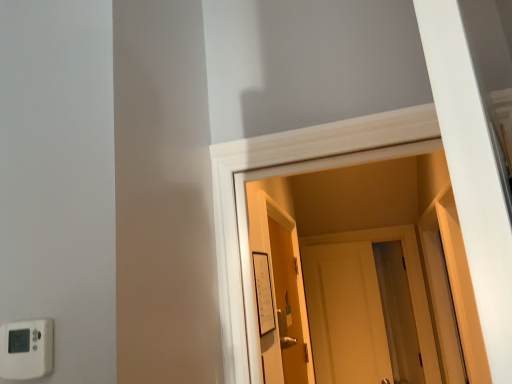
Locate an element on the screen. white paper at center, the 2th light switch in the left-to-right sequence is located at coordinates (263, 293).

Describe the element at coordinates (26, 349) in the screenshot. The image size is (512, 384). I see `white plastic thermostat at lower left, the first light switch when ordered from front to back` at that location.

How much space does white plastic thermostat at lower left, the second light switch positioned from the back, occupy vertically?

9.48 centimeters.

Find the location of `white matte door at center, acting as the 2th door starting from the left`. white matte door at center, acting as the 2th door starting from the left is located at coordinates (408, 281).

Which of these two, white matte door at center, which is the 1th door from back to front, or white plastic thermostat at lower left, the second light switch in the right-to-left sequence, stands taller?

With more height is white matte door at center, which is the 1th door from back to front.

Does point (402, 244) lie in front of point (24, 364)?

No.

Is white matte door at center, which is the 1th door from back to front, in front of or behind white plastic thermostat at lower left, the first light switch when ordered from front to back, in the image?

Visually, white matte door at center, which is the 1th door from back to front, is located behind white plastic thermostat at lower left, the first light switch when ordered from front to back.

In terms of size, does white matte door at center, which is the 1th door from back to front, appear bigger or smaller than white plastic thermostat at lower left, the first light switch when ordered from front to back?

In the image, white matte door at center, which is the 1th door from back to front, appears to be larger than white plastic thermostat at lower left, the first light switch when ordered from front to back.

This screenshot has width=512, height=384. There is a white plastic thermostat at lower left, the second light switch in the right-to-left sequence. Find the location of `the 2nd door below it (from a real-world perspective)`. the 2nd door below it (from a real-world perspective) is located at coordinates (408, 281).

From a real-world perspective, is white plastic thermostat at lower left, the first light switch when ordered from front to back, positioned under white matte door at center, acting as the 2th door starting from the left, based on gravity?

No, from a real-world perspective, white plastic thermostat at lower left, the first light switch when ordered from front to back, is not under white matte door at center, acting as the 2th door starting from the left.

Is white plastic thermostat at lower left, the second light switch in the right-to-left sequence, to the right of white matte door at center, which is the 1th door from back to front, from the viewer's perspective?

Incorrect, white plastic thermostat at lower left, the second light switch in the right-to-left sequence, is not on the right side of white matte door at center, which is the 1th door from back to front.

Is white plastic thermostat at lower left, the second light switch in the right-to-left sequence, next to white matte door at center, which is the second door in front-to-back order, and touching it?

white plastic thermostat at lower left, the second light switch in the right-to-left sequence, is not next to white matte door at center, which is the second door in front-to-back order, and they're not touching.

Is white paper at center, the 2th light switch in the left-to-right sequence, aimed at white plastic thermostat at lower left, positioned as the 1th light switch in left-to-right order?

No.

Does white paper at center, acting as the first light switch starting from the right, have a larger size compared to white plastic thermostat at lower left, positioned as the 1th light switch in left-to-right order?

Yes, white paper at center, acting as the first light switch starting from the right, is bigger than white plastic thermostat at lower left, positioned as the 1th light switch in left-to-right order.

Is white paper at center, acting as the first light switch starting from the right, positioned before white plastic thermostat at lower left, the second light switch positioned from the back?

No, it is behind white plastic thermostat at lower left, the second light switch positioned from the back.

From their relative heights in the image, would you say white paper at center, the 2th light switch in the left-to-right sequence, is taller or shorter than white plastic thermostat at lower left, the first light switch when ordered from front to back?

In the image, white paper at center, the 2th light switch in the left-to-right sequence, appears to be taller than white plastic thermostat at lower left, the first light switch when ordered from front to back.

Does white matte door at center, which is the 1th door from back to front, contain white paper at center, the 1th light switch viewed from the back?

That's incorrect, white paper at center, the 1th light switch viewed from the back, is not inside white matte door at center, which is the 1th door from back to front.

From the picture: Is there a large distance between white matte door at center, acting as the 2th door starting from the left, and white paper at center, which is counted as the 2th light switch, starting from the front?

Absolutely, white matte door at center, acting as the 2th door starting from the left, is distant from white paper at center, which is counted as the 2th light switch, starting from the front.

From a real-world perspective, count 2nd light switchs upward from the white matte door at center, which is the first door from right to left, and point to it. Please provide its 2D coordinates.

[(263, 293)]

Considering the positions of points (417, 252) and (255, 255), is point (417, 252) closer to camera compared to point (255, 255)?

No, (417, 252) is behind (255, 255).

From the picture: Which is more to the left, white matte door at center, which is the 1th door from back to front, or wooden door at center, positioned as the 1th door in front-to-back order?

wooden door at center, positioned as the 1th door in front-to-back order.

Is white matte door at center, which is the second door in front-to-back order, oriented towards wooden door at center, positioned as the 1th door in front-to-back order?

Yes, white matte door at center, which is the second door in front-to-back order, is turned towards wooden door at center, positioned as the 1th door in front-to-back order.

Which is closer, (436, 353) or (288, 348)?

Point (436, 353) is positioned farther from the camera compared to point (288, 348).

From a real-world perspective, is white matte door at center, acting as the 2th door starting from the left, physically above wooden door at center, marked as the 1th door in a left-to-right arrangement?

Actually, white matte door at center, acting as the 2th door starting from the left, is physically below wooden door at center, marked as the 1th door in a left-to-right arrangement, in the real world.

Is white paper at center, the 2th light switch in the left-to-right sequence, turned away from wooden door at center, the second door positioned from the right?

No, white paper at center, the 2th light switch in the left-to-right sequence, is not facing away from wooden door at center, the second door positioned from the right.

Can you confirm if white paper at center, the 2th light switch in the left-to-right sequence, is shorter than wooden door at center, placed as the second door when sorted from back to front?

Correct, white paper at center, the 2th light switch in the left-to-right sequence, is not as tall as wooden door at center, placed as the second door when sorted from back to front.

Is white paper at center, the 1th light switch viewed from the back, positioned beyond the bounds of wooden door at center, placed as the second door when sorted from back to front?

Yes.

Is point (259, 310) closer to camera compared to point (294, 273)?

That is True.

Which is closer to the camera, (294, 303) or (24, 372)?

Clearly, point (294, 303) is more distant from the camera than point (24, 372).

Who is shorter, wooden door at center, the second door positioned from the right, or white plastic thermostat at lower left, positioned as the 1th light switch in left-to-right order?

white plastic thermostat at lower left, positioned as the 1th light switch in left-to-right order.

Considering the sizes of objects wooden door at center, placed as the second door when sorted from back to front, and white plastic thermostat at lower left, the first light switch when ordered from front to back, in the image provided, who is wider, wooden door at center, placed as the second door when sorted from back to front, or white plastic thermostat at lower left, the first light switch when ordered from front to back,?

Wider between the two is wooden door at center, placed as the second door when sorted from back to front.

Can you tell me how much wooden door at center, the second door positioned from the right, and white plastic thermostat at lower left, the second light switch positioned from the back, differ in facing direction?

The angular difference between wooden door at center, the second door positioned from the right, and white plastic thermostat at lower left, the second light switch positioned from the back, is 91.1 degrees.

From a real-world perspective, which door is the 2nd one underneath the white plastic thermostat at lower left, positioned as the 1th light switch in left-to-right order? Please provide its 2D coordinates.

[(408, 281)]

You are a GUI agent. You are given a task and a screenshot of the screen. Output one action in this format:
    pyautogui.click(x=<x>, y=<y>)
    Task: Click on the 1st light switch above the white matte door at center, which is the second door in front-to-back order (from a real-world perspective)
    The width and height of the screenshot is (512, 384).
    Given the screenshot: What is the action you would take?
    [x=26, y=349]

Based on their spatial positions, is white matte door at center, which is the first door from right to left, or white plastic thermostat at lower left, positioned as the 1th light switch in left-to-right order, closer to white paper at center, the 1th light switch viewed from the back?

The object closer to white paper at center, the 1th light switch viewed from the back, is white plastic thermostat at lower left, positioned as the 1th light switch in left-to-right order.

When comparing their distances from white paper at center, the 1th light switch viewed from the back, does white plastic thermostat at lower left, the second light switch in the right-to-left sequence, or wooden door at center, placed as the second door when sorted from back to front, seem further?

Among the two, white plastic thermostat at lower left, the second light switch in the right-to-left sequence, is located further to white paper at center, the 1th light switch viewed from the back.

Based on their spatial positions, is white plastic thermostat at lower left, the second light switch in the right-to-left sequence, or wooden door at center, placed as the second door when sorted from back to front, closer to white matte door at center, acting as the 2th door starting from the left?

wooden door at center, placed as the second door when sorted from back to front, is closer to white matte door at center, acting as the 2th door starting from the left.

Which object lies further to the anchor point white matte door at center, which is the 1th door from back to front, white plastic thermostat at lower left, positioned as the 1th light switch in left-to-right order, or white paper at center, which is counted as the 2th light switch, starting from the front?

Among the two, white plastic thermostat at lower left, positioned as the 1th light switch in left-to-right order, is located further to white matte door at center, which is the 1th door from back to front.

Considering their positions, is wooden door at center, positioned as the 1th door in front-to-back order, positioned closer to white plastic thermostat at lower left, the second light switch in the right-to-left sequence, than white matte door at center, acting as the 2th door starting from the left?

wooden door at center, positioned as the 1th door in front-to-back order.

Looking at the image, which one is located further to wooden door at center, positioned as the 1th door in front-to-back order, white paper at center, the 2th light switch in the left-to-right sequence, or white plastic thermostat at lower left, the first light switch when ordered from front to back?

white plastic thermostat at lower left, the first light switch when ordered from front to back, is further to wooden door at center, positioned as the 1th door in front-to-back order.

Estimate the real-world distances between objects in this image. Which object is further from white plastic thermostat at lower left, the second light switch positioned from the back, white paper at center, acting as the first light switch starting from the right, or white matte door at center, which is the second door in front-to-back order?

white matte door at center, which is the second door in front-to-back order, lies further to white plastic thermostat at lower left, the second light switch positioned from the back, than the other object.

Based on their spatial positions, is white paper at center, the 1th light switch viewed from the back, or white plastic thermostat at lower left, positioned as the 1th light switch in left-to-right order, further from white matte door at center, which is the second door in front-to-back order?

white plastic thermostat at lower left, positioned as the 1th light switch in left-to-right order, is further to white matte door at center, which is the second door in front-to-back order.

The image size is (512, 384). I want to click on light switch between white plastic thermostat at lower left, the first light switch when ordered from front to back, and wooden door at center, marked as the 1th door in a left-to-right arrangement, from front to back, so click(263, 293).

I want to click on light switch positioned between white plastic thermostat at lower left, the second light switch in the right-to-left sequence, and white matte door at center, which is the 1th door from back to front, from near to far, so click(x=263, y=293).

Where is `door between white plastic thermostat at lower left, the second light switch positioned from the back, and white matte door at center, acting as the 2th door starting from the left, along the z-axis`? This screenshot has height=384, width=512. door between white plastic thermostat at lower left, the second light switch positioned from the back, and white matte door at center, acting as the 2th door starting from the left, along the z-axis is located at coordinates (288, 303).

You are a GUI agent. You are given a task and a screenshot of the screen. Output one action in this format:
    pyautogui.click(x=<x>, y=<y>)
    Task: Click on the door positioned between white paper at center, the 1th light switch viewed from the back, and white matte door at center, which is the second door in front-to-back order, from near to far
    
    Given the screenshot: What is the action you would take?
    pyautogui.click(x=288, y=303)